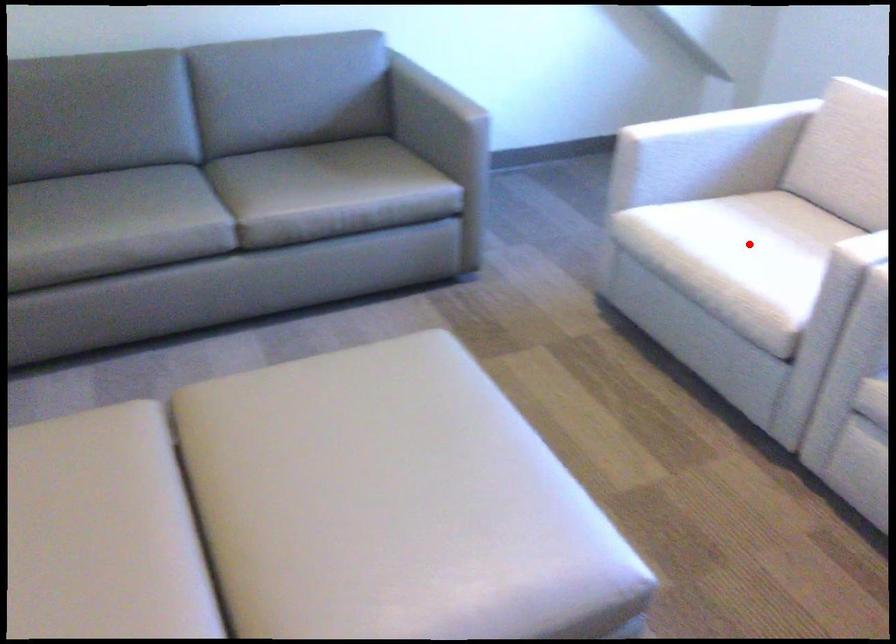
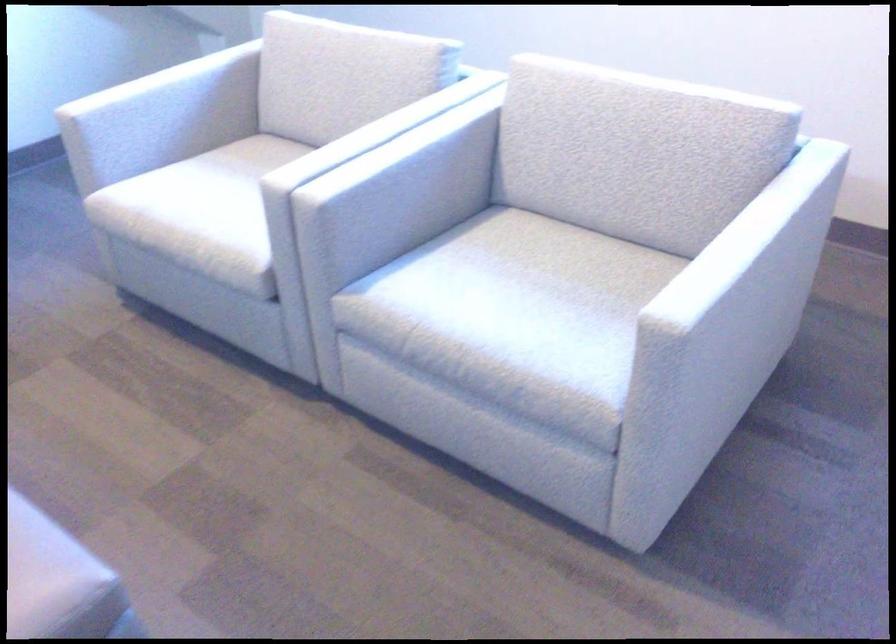
Locate, in the second image, the point that corresponds to the highlighted location in the first image.

(220, 196)